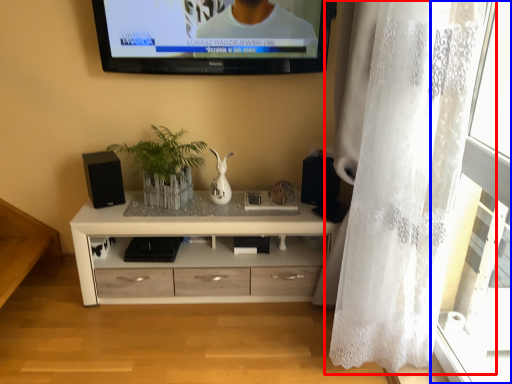
Question: Which point is closer to the camera, curtain (highlighted by a red box) or glass door (highlighted by a blue box)?

Choices:
 (A) curtain
 (B) glass door

Answer: (B)